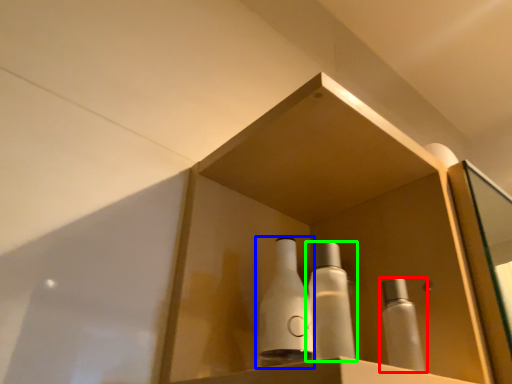
Question: Which is nearer to the bottle (highlighted by a red box)? bottle (highlighted by a blue box) or bottle (highlighted by a green box).

Choices:
 (A) bottle
 (B) bottle

Answer: (B)